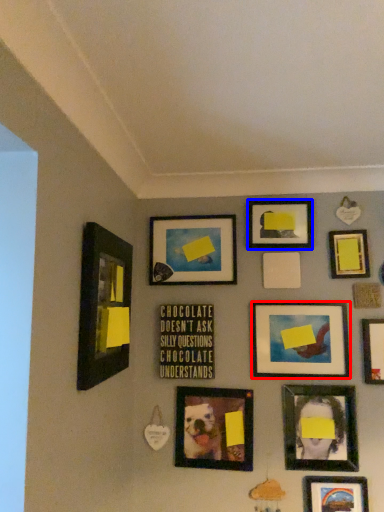
Question: Which object is closer to the camera taking this photo, picture frame (highlighted by a red box) or picture frame (highlighted by a blue box)?

Choices:
 (A) picture frame
 (B) picture frame

Answer: (A)